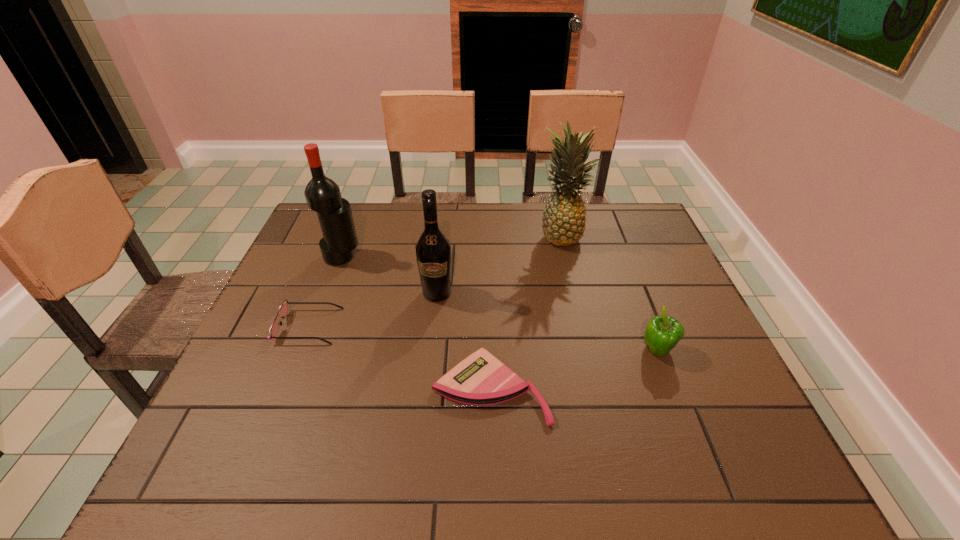
The width and height of the screenshot is (960, 540). Identify the location of free space located 0.240m on the label of the nearer wine bottle. point(428,380).

Where is `vacant space located on the back of the bell pepper`? The image size is (960, 540). vacant space located on the back of the bell pepper is located at coordinates (624, 266).

At what (x,y) coordinates should I click in order to perform the action: click on free space located on the bridge of the fifth tallest object. Please return your answer as a coordinate pair (x, y). The width and height of the screenshot is (960, 540). Looking at the image, I should click on pyautogui.click(x=486, y=326).

The height and width of the screenshot is (540, 960). I want to click on vacant space located 0.160m on the right of the wristlet, so [621, 388].

Where is `object located in the far edge section of the desktop`? Image resolution: width=960 pixels, height=540 pixels. object located in the far edge section of the desktop is located at coordinates (563, 222).

Where is `wine bottle at the left edge`? The width and height of the screenshot is (960, 540). wine bottle at the left edge is located at coordinates [x=322, y=194].

Image resolution: width=960 pixels, height=540 pixels. I want to click on sunglasses positioned at the left edge, so click(x=283, y=310).

I want to click on object that is at the right edge, so click(663, 332).

I want to click on free spot at the far edge of the desktop, so click(507, 208).

Where is `free space at the near edge`? The width and height of the screenshot is (960, 540). free space at the near edge is located at coordinates (590, 471).